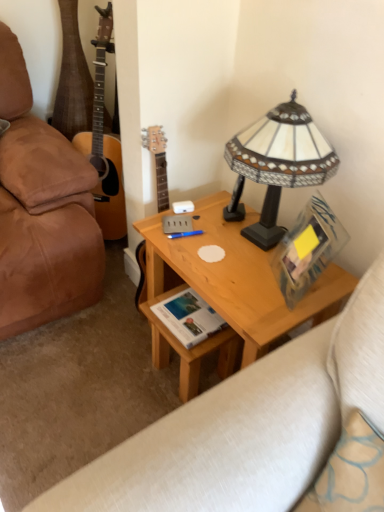
Question: Is the depth of blue plastic pen at center less than that of white paper book at center?

Choices:
 (A) yes
 (B) no

Answer: (B)

Question: From a real-world perspective, is blue plastic pen at center on white paper book at center?

Choices:
 (A) no
 (B) yes

Answer: (B)

Question: Does blue plastic pen at center come behind white paper book at center?

Choices:
 (A) yes
 (B) no

Answer: (A)

Question: Is blue plastic pen at center oriented away from white paper book at center?

Choices:
 (A) no
 (B) yes

Answer: (A)

Question: Considering the relative sizes of blue plastic pen at center and white paper book at center in the image provided, is blue plastic pen at center thinner than white paper book at center?

Choices:
 (A) yes
 (B) no

Answer: (A)

Question: Is blue plastic pen at center positioned far away from white paper book at center?

Choices:
 (A) yes
 (B) no

Answer: (B)

Question: Does light wood desk at center have a lesser height compared to leather studio couch at lower left?

Choices:
 (A) no
 (B) yes

Answer: (A)

Question: Is leather studio couch at lower left a part of light wood desk at center?

Choices:
 (A) no
 (B) yes

Answer: (A)

Question: Is light wood desk at center thinner than leather studio couch at lower left?

Choices:
 (A) yes
 (B) no

Answer: (A)

Question: Is light wood desk at center positioned before leather studio couch at lower left?

Choices:
 (A) yes
 (B) no

Answer: (A)

Question: From a real-world perspective, is light wood desk at center physically above leather studio couch at lower left?

Choices:
 (A) no
 (B) yes

Answer: (B)

Question: Is light wood desk at center taller than leather studio couch at lower left?

Choices:
 (A) yes
 (B) no

Answer: (A)

Question: Does white paper book at center appear on the left side of light wood desk at center?

Choices:
 (A) yes
 (B) no

Answer: (A)